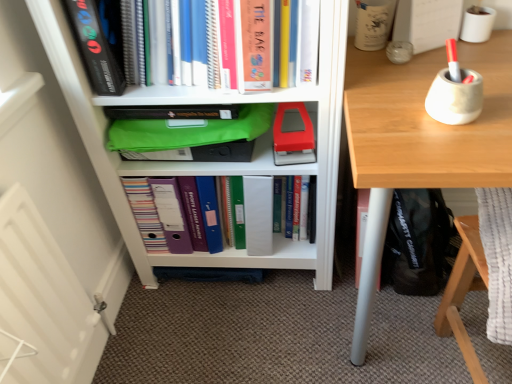
This screenshot has height=384, width=512. I want to click on vacant space in front of matte green plastic bag at center, so click(x=244, y=341).